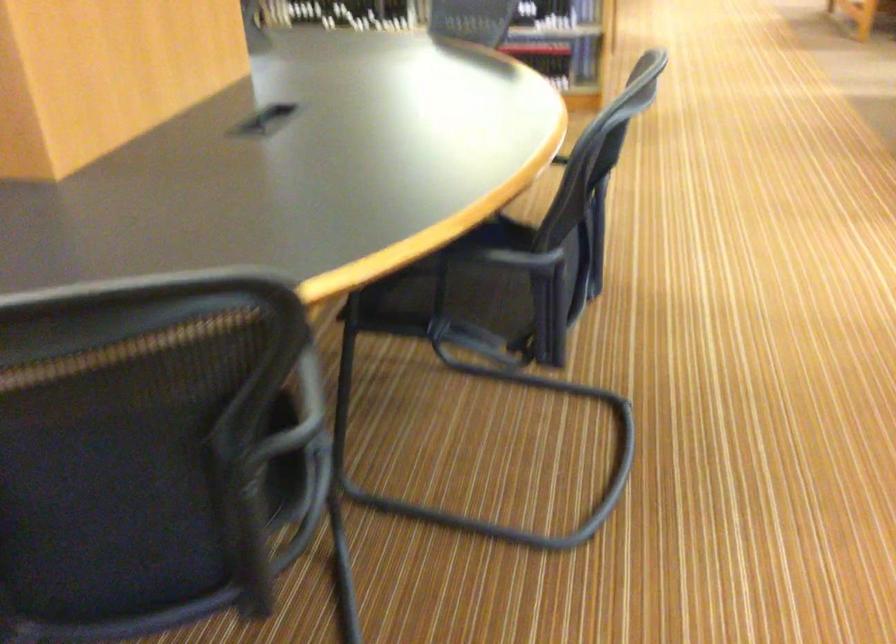
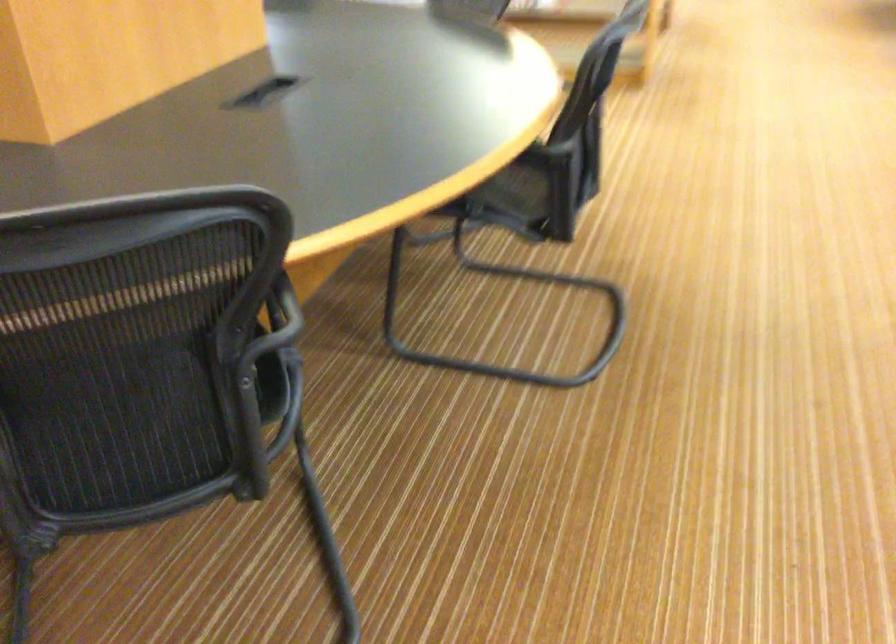
Question: What movement of the cameraman would produce the second image?

Choices:
 (A) Left
 (B) Right
 (C) Forward
 (D) Backward

Answer: (D)